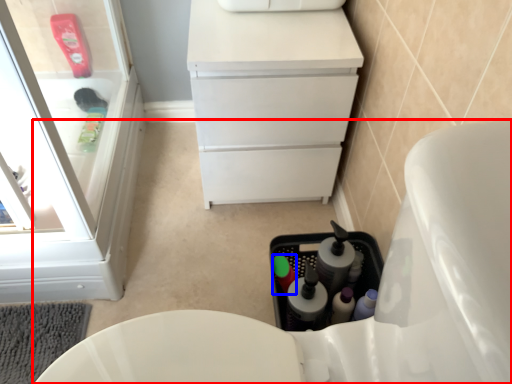
Question: Which of the following is the closest to the observer, toilet (highlighted by a red box) or bottle (highlighted by a blue box)?

Choices:
 (A) toilet
 (B) bottle

Answer: (A)